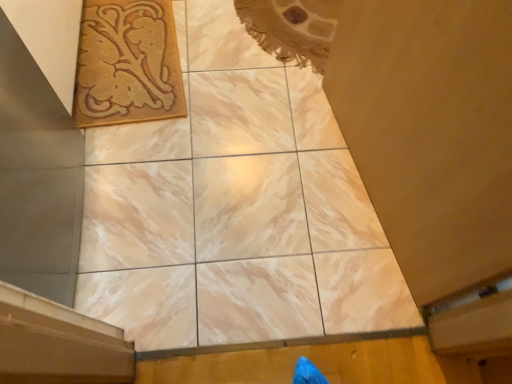
Find the location of `beige woven rug at upper left`. beige woven rug at upper left is located at coordinates (127, 64).

What do you see at coordinates (127, 64) in the screenshot? I see `beige woven rug at upper left` at bounding box center [127, 64].

The width and height of the screenshot is (512, 384). What do you see at coordinates (249, 207) in the screenshot?
I see `marble tile at center` at bounding box center [249, 207].

Image resolution: width=512 pixels, height=384 pixels. I want to click on beige woven rug at upper left, so click(x=127, y=64).

Considering the relative sizes of marble tile at center and wooden at lower right in the image provided, is marble tile at center bigger than wooden at lower right?

No, marble tile at center is not bigger than wooden at lower right.

Is marble tile at center not within wooden at lower right?

That's correct, marble tile at center is outside of wooden at lower right.

From the image's perspective, is marble tile at center located above or below wooden at lower right?

marble tile at center is situated higher than wooden at lower right in the image.

Considering the relative positions of wooden at lower right and beige woven rug at upper left in the image provided, is wooden at lower right to the left or to the right of beige woven rug at upper left?

From the image, it's evident that wooden at lower right is to the right of beige woven rug at upper left.

Considering the points (423, 360) and (131, 118), which point is behind, point (423, 360) or point (131, 118)?

Point (131, 118)

Is wooden at lower right placed right next to beige woven rug at upper left?

No, wooden at lower right is not in contact with beige woven rug at upper left.

Is wooden at lower right in front of or behind beige woven rug at upper left in the image?

In the image, wooden at lower right appears in front of beige woven rug at upper left.

Is beige woven rug at upper left inside the boundaries of wooden at lower right, or outside?

beige woven rug at upper left is located beyond the bounds of wooden at lower right.

From a real-world perspective, is beige woven rug at upper left above or below wooden at lower right?

beige woven rug at upper left is situated lower than wooden at lower right in the real world.

Is beige woven rug at upper left aimed at wooden at lower right?

No, beige woven rug at upper left is not facing towards wooden at lower right.

Is beige woven rug at upper left placed right next to wooden at lower right?

beige woven rug at upper left and wooden at lower right are not in contact.

Between marble tile at center and beige woven rug at upper left, which one appears on the right side from the viewer's perspective?

Positioned to the right is marble tile at center.

What's the angular difference between marble tile at center and beige woven rug at upper left's facing directions?

They differ by 56.3 degrees in their facing directions.

From a real-world perspective, is marble tile at center above or below beige woven rug at upper left?

marble tile at center is below beige woven rug at upper left.

Which point is more forward, [239,196] or [106,38]?

Positioned in front is point [239,196].

Who is taller, beige woven rug at upper left or marble tile at center?

beige woven rug at upper left.

Is beige woven rug at upper left far away from marble tile at center?

No, beige woven rug at upper left is in close proximity to marble tile at center.

Does beige woven rug at upper left lie in front of marble tile at center?

No, beige woven rug at upper left is further to the viewer.

Is wooden at lower right with marble tile at center?

wooden at lower right and marble tile at center are not in contact.

Based on the photo, could you tell me if wooden at lower right is turned towards marble tile at center?

No, wooden at lower right is not facing towards marble tile at center.

Is wooden at lower right bigger than marble tile at center?

Indeed, wooden at lower right has a larger size compared to marble tile at center.

I want to click on tile above the wooden at lower right (from the image's perspective), so click(249, 207).

Locate an element on the screen. This screenshot has height=384, width=512. plywood positioned vertically above the beige woven rug at upper left (from a real-world perspective) is located at coordinates (296, 361).

Based on their spatial positions, is wooden at lower right or marble tile at center further from beige woven rug at upper left?

wooden at lower right is positioned further to the anchor beige woven rug at upper left.

Looking at the image, which one is located further to wooden at lower right, beige woven rug at upper left or marble tile at center?

Among the two, beige woven rug at upper left is located further to wooden at lower right.

From the image, which object appears to be nearer to marble tile at center, wooden at lower right or beige woven rug at upper left?

wooden at lower right is closer to marble tile at center.

From the image, which object appears to be nearer to beige woven rug at upper left, marble tile at center or wooden at lower right?

Based on the image, marble tile at center appears to be nearer to beige woven rug at upper left.

Looking at the image, which one is located further to wooden at lower right, marble tile at center or beige woven rug at upper left?

The object further to wooden at lower right is beige woven rug at upper left.

Which object lies nearer to the anchor point marble tile at center, beige woven rug at upper left or wooden at lower right?

Based on the image, wooden at lower right appears to be nearer to marble tile at center.

Locate an element on the screen. tile that lies between beige woven rug at upper left and wooden at lower right from top to bottom is located at coordinates (249, 207).